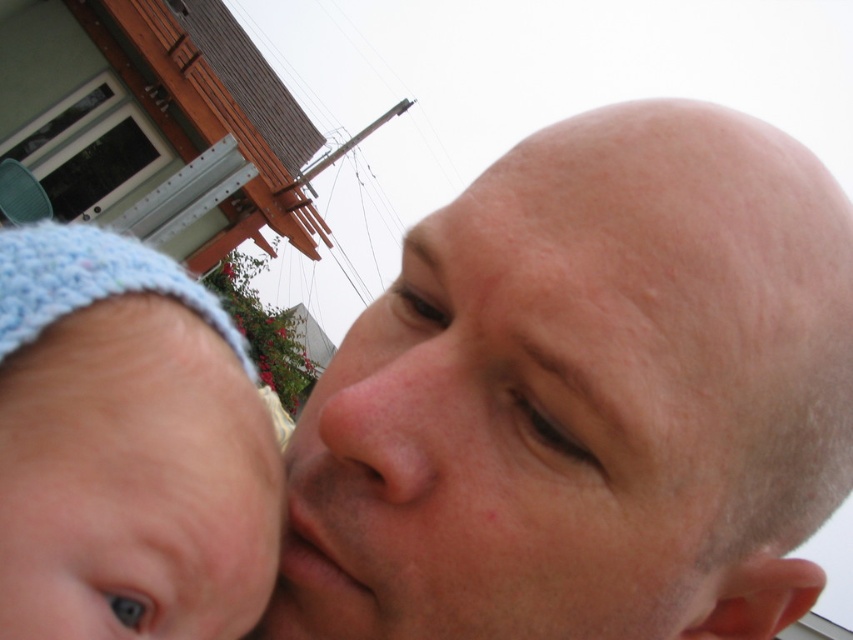
Measure the distance from smooth skin head at center to pink smooth skin at center.

smooth skin head at center is 3.21 inches from pink smooth skin at center.

Between point (590, 262) and point (376, 451), which one is positioned in front?

Positioned in front is point (590, 262).

Where is `smooth skin head at center`? The height and width of the screenshot is (640, 853). smooth skin head at center is located at coordinates (585, 397).

What are the coordinates of `smooth skin head at center` in the screenshot? It's located at (585, 397).

Does knitted blue hat at left appear over pink smooth skin at center?

Yes, knitted blue hat at left is above pink smooth skin at center.

Who is higher up, knitted blue hat at left or pink smooth skin at center?

knitted blue hat at left is higher up.

Image resolution: width=853 pixels, height=640 pixels. What are the coordinates of `knitted blue hat at left` in the screenshot? It's located at (126, 445).

Who is more forward, (x=524, y=170) or (x=105, y=257)?

Point (x=105, y=257)

Can you confirm if smooth skin head at center is taller than knitted blue hat at left?

Yes, smooth skin head at center is taller than knitted blue hat at left.

Between point (657, 353) and point (268, 540), which one is positioned in front?

Point (657, 353)

The height and width of the screenshot is (640, 853). In order to click on smooth skin head at center in this screenshot , I will do `click(585, 397)`.